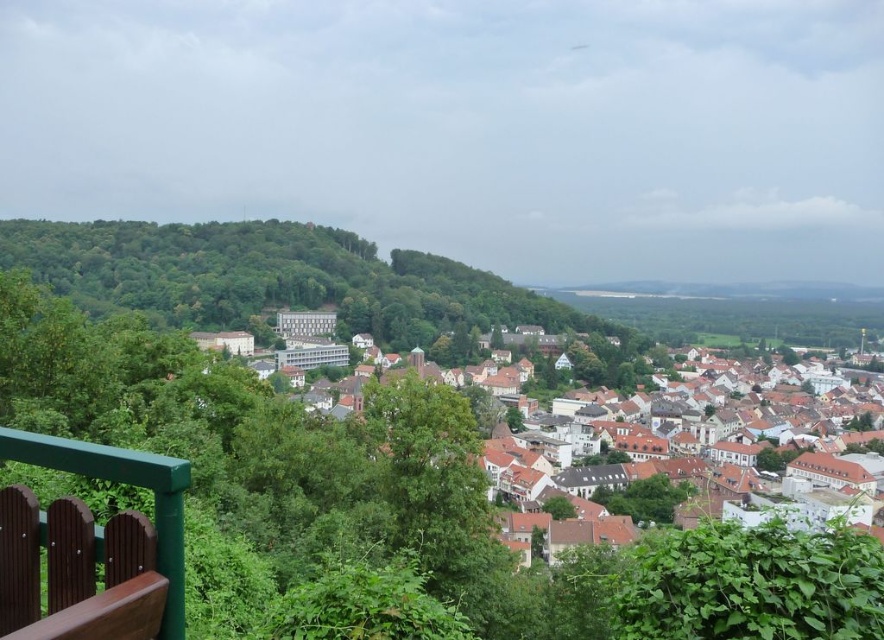
You are standing at the viewpoint on the wooden railing and want to know how far the point marked as point (677, 452) is from your current position. Can you determine the distance?

The point marked as point (677, 452) is 754.76 feet away from the camera, so the distance from your current position at the viewpoint on the wooden railing to that point is 754.76 feet.

You are standing at the viewpoint overlooking the town and want to take a photo that includes both the wooden railing and the distant town. If you focus on the point at coordinates point (437, 394) and point (174, 516), which point is farther away from your current position?

Point (437, 394) is behind point (174, 516), so the point at coordinates point (437, 394) is farther away from your current position.